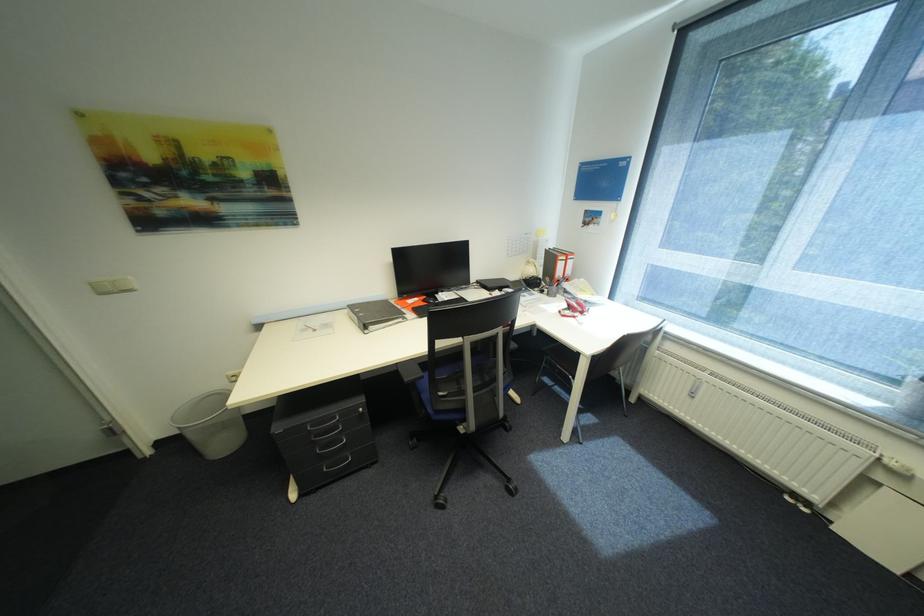
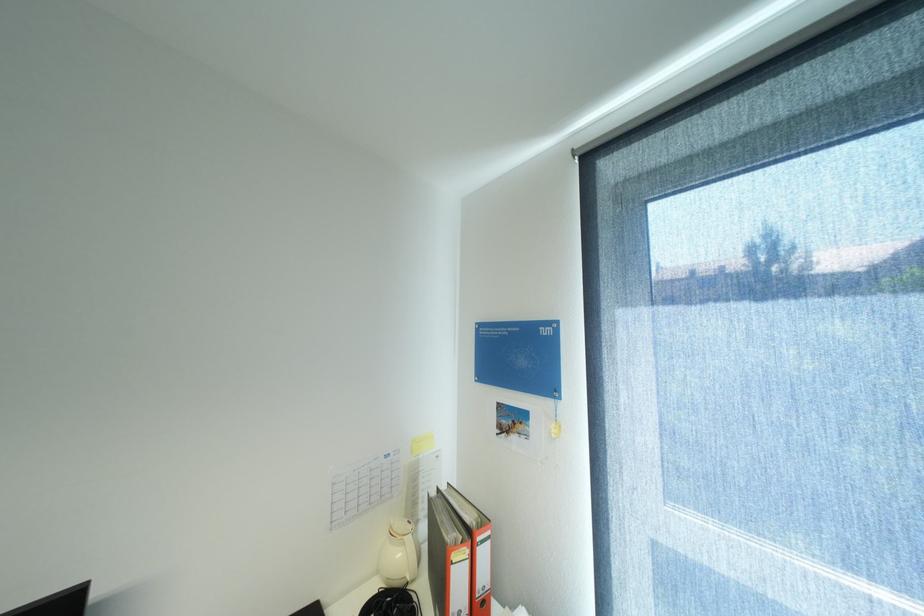
In the second image, find the point that corresponds to the point at 540,270 in the first image.

(407, 554)